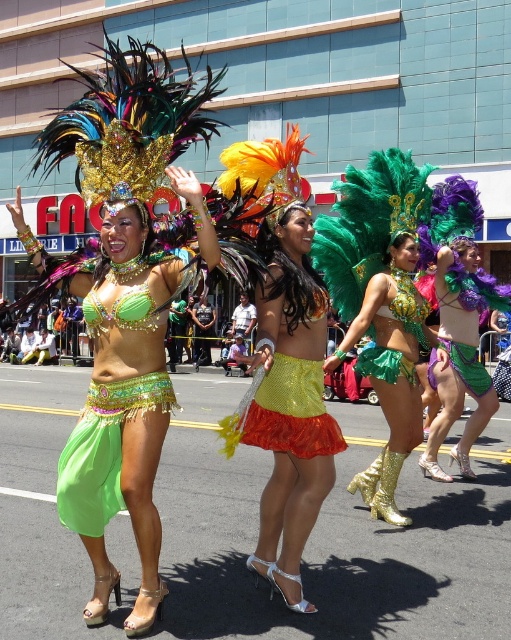
Is point (133, 337) farther from camera compared to point (286, 269)?

No, it is not.

Is green sequined skirt at center positioned before shiny sequined skirt at center?

Yes, green sequined skirt at center is closer to the viewer.

Does point (128, 252) come behind point (236, 429)?

No, (128, 252) is closer to viewer.

Image resolution: width=511 pixels, height=640 pixels. In order to click on green sequined skirt at center in this screenshot , I will do `click(121, 408)`.

Who is shorter, green sequined skirt at center or shiny green fabric skirt at center?

With less height is shiny green fabric skirt at center.

Which is below, green sequined skirt at center or shiny green fabric skirt at center?

green sequined skirt at center is lower down.

Looking at this image, who is more distant from viewer, [122,371] or [398,296]?

Point [398,296]

Image resolution: width=511 pixels, height=640 pixels. I want to click on green sequined skirt at center, so click(x=121, y=408).

Is shiny gold boots at center smaller than shiny green fabric skirt at center?

No.

Is point (373, 289) positioned after point (410, 369)?

Yes, point (373, 289) is behind point (410, 369).

Where is `shiny gold boots at center`? shiny gold boots at center is located at coordinates 389,371.